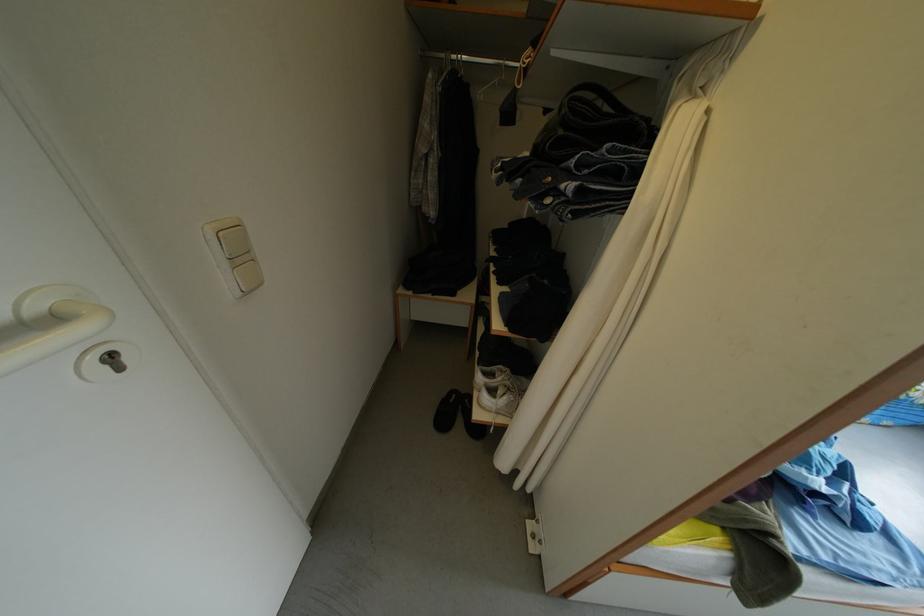
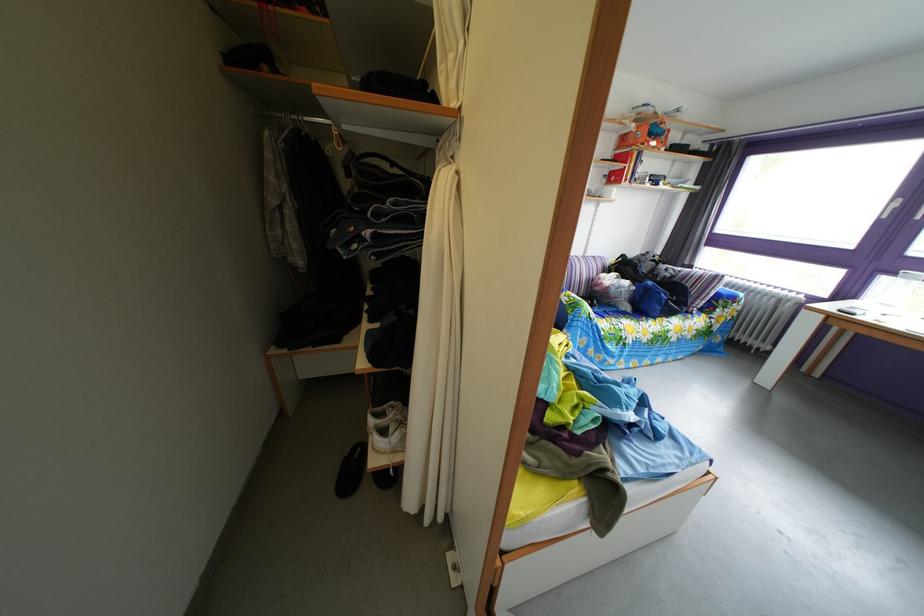
Question: The camera is either moving clockwise (left) or counter-clockwise (right) around the object. The first image is from the beginning of the video and the second image is from the end. Is the camera moving left or right when shooting the video?

Choices:
 (A) Left
 (B) Right

Answer: (A)